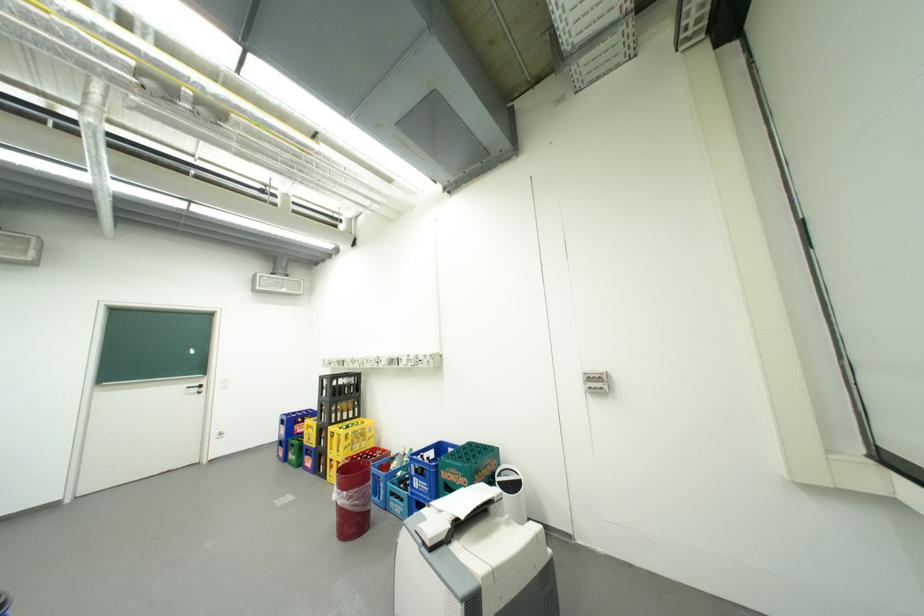
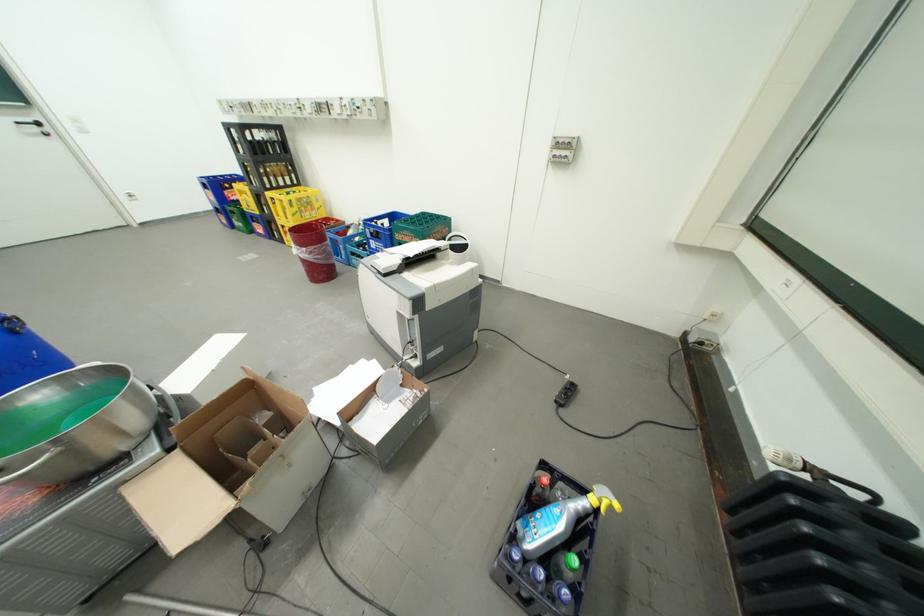
In the second image, find the point that corresponds to [356,493] in the first image.

(314, 249)